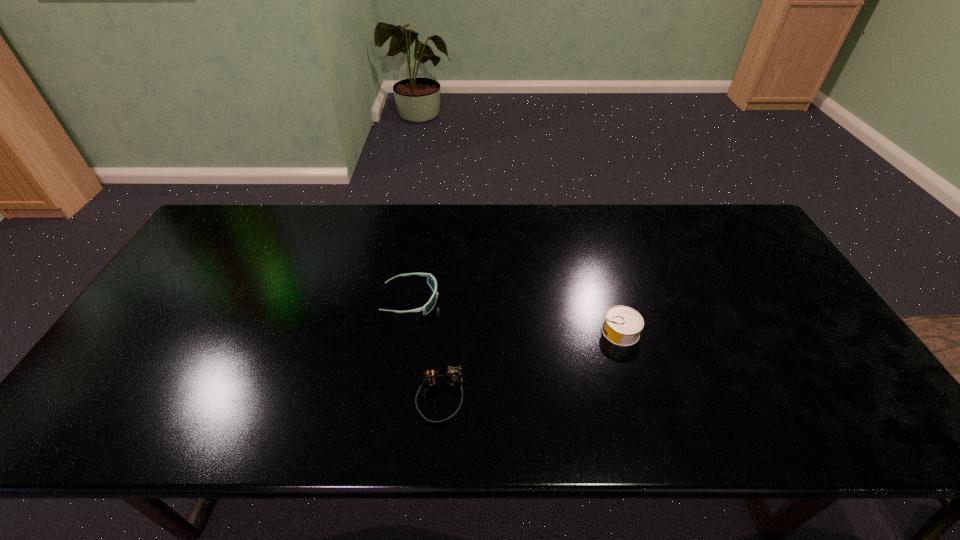
Find the location of `empty space between the farther goggles and the can`. empty space between the farther goggles and the can is located at coordinates (516, 316).

Locate an element on the screen. This screenshot has width=960, height=540. object that is the closest to the farther goggles is located at coordinates (453, 377).

Identify which object is located as the nearest to the can. Please provide its 2D coordinates. Your answer should be formatted as a tuple, i.e. [(x, y)], where the tuple contains the x and y coordinates of a point satisfying the conditions above.

[(453, 377)]

You are a GUI agent. You are given a task and a screenshot of the screen. Output one action in this format:
    pyautogui.click(x=<x>, y=<y>)
    Task: Click on the free space that satisfies the following two spatial constraints: 1. on the front-facing side of the farther goggles; 2. on the left side of the rightmost object
    Image resolution: width=960 pixels, height=540 pixels.
    Given the screenshot: What is the action you would take?
    pyautogui.click(x=406, y=332)

I want to click on free space that satisfies the following two spatial constraints: 1. on the front-facing side of the farther goggles; 2. on the left side of the rightmost object, so click(406, 332).

This screenshot has width=960, height=540. Find the location of `blank space that satisfies the following two spatial constraints: 1. on the front-facing side of the farther goggles; 2. on the right side of the can`. blank space that satisfies the following two spatial constraints: 1. on the front-facing side of the farther goggles; 2. on the right side of the can is located at coordinates (406, 332).

At what (x,y) coordinates should I click in order to perform the action: click on vacant position in the image that satisfies the following two spatial constraints: 1. on the back side of the rightmost object; 2. on the front-facing side of the farther goggles. Please return your answer as a coordinate pair (x, y). Looking at the image, I should click on (612, 300).